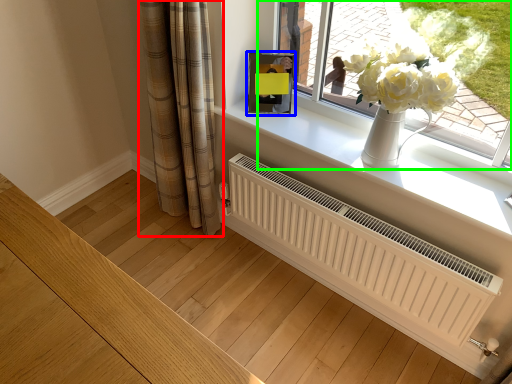
Question: Which is nearer to the curtain (highlighted by a red box)? picture frame (highlighted by a blue box) or window (highlighted by a green box).

Choices:
 (A) picture frame
 (B) window

Answer: (A)